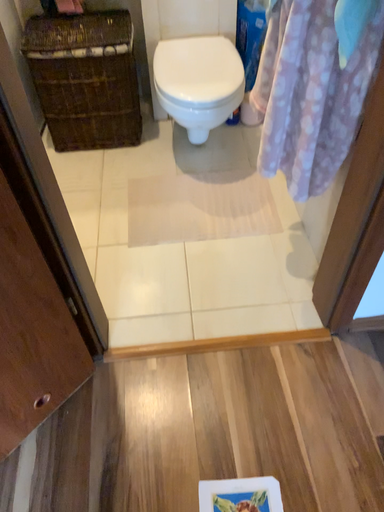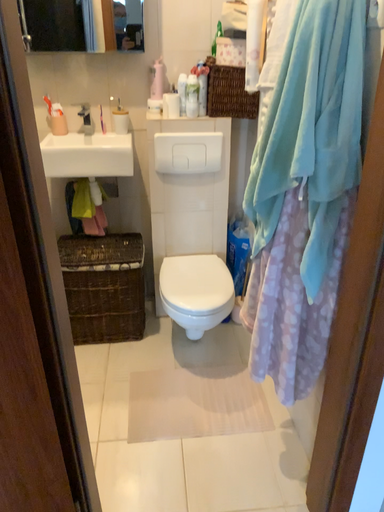
Question: How did the camera likely rotate when shooting the video?

Choices:
 (A) rotated downward
 (B) rotated upward

Answer: (B)